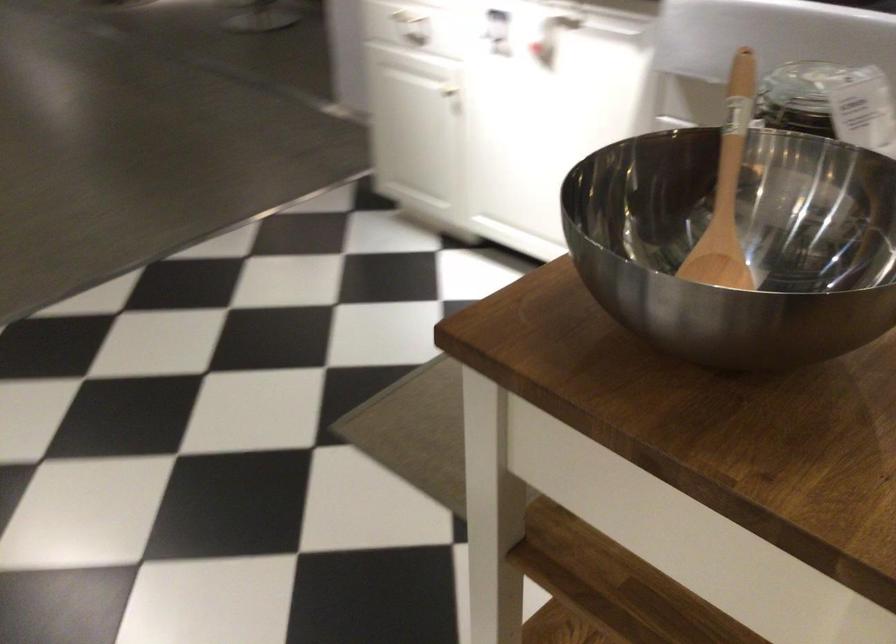
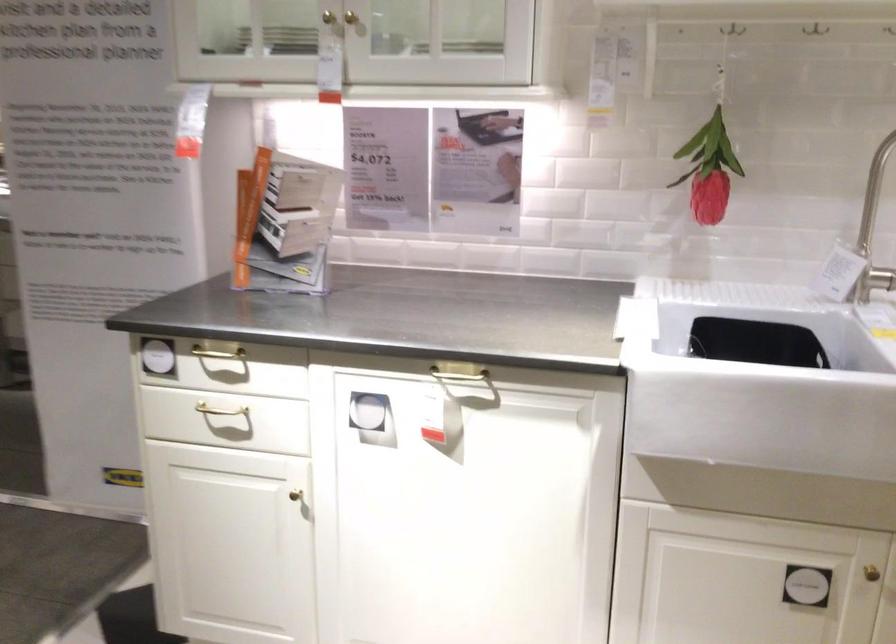
The point at (x=449, y=96) is marked in the first image. Where is the corresponding point in the second image?

(296, 496)